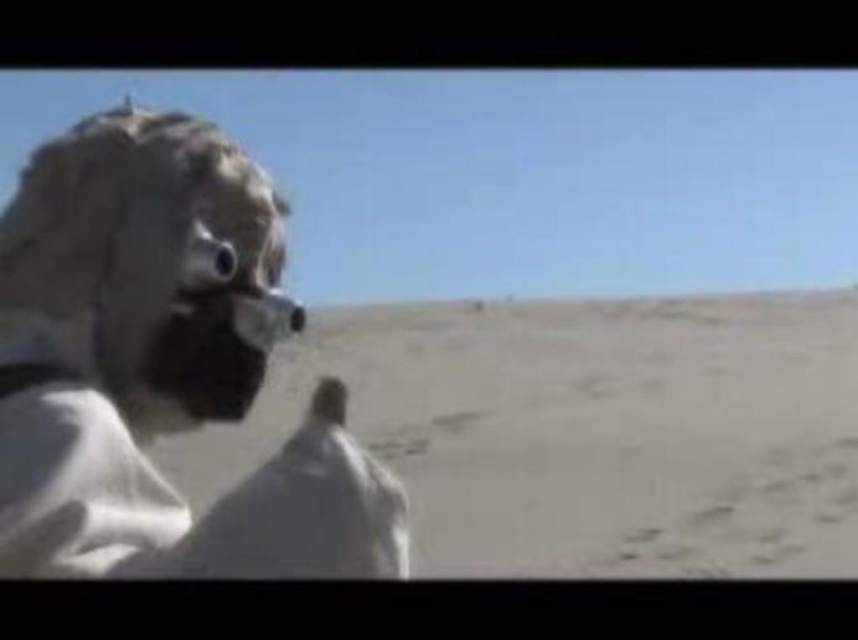
You are standing at the origin point in the desert scene. There are two points marked in the image. Which point is farther away from you, point (578, 392) or point (202, 536)?

Point (578, 392) is behind point (202, 536), so it is farther away from you.

You are a traveler in the desert and need to cross the area. You see the smooth beige sand at center and the white matte mask at left. Which object is located lower in the image?

The smooth beige sand at center is located lower than the white matte mask at left in the image.